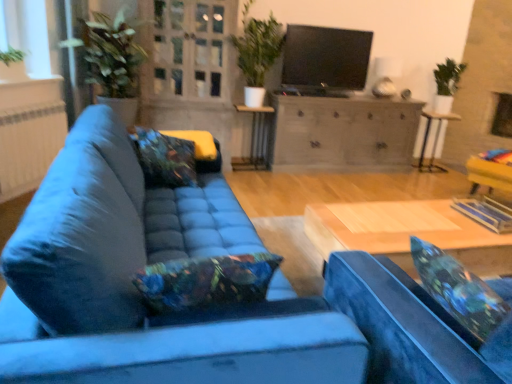
Question: Is the depth of white textured radiator at left less than that of floral fabric pillow at center, the 1th pillow from the front?

Choices:
 (A) yes
 (B) no

Answer: (B)

Question: Is white textured radiator at left beside floral fabric pillow at center, marked as the first pillow in a left-to-right arrangement?

Choices:
 (A) no
 (B) yes

Answer: (A)

Question: Does white textured radiator at left appear on the right side of floral fabric pillow at center, the 1th pillow from the front?

Choices:
 (A) yes
 (B) no

Answer: (B)

Question: Can you confirm if white textured radiator at left is wider than floral fabric pillow at center, the second pillow positioned from the back?

Choices:
 (A) yes
 (B) no

Answer: (B)

Question: Does white textured radiator at left come behind floral fabric pillow at center, the 1th pillow from the front?

Choices:
 (A) no
 (B) yes

Answer: (B)

Question: Is white textured radiator at left taller than floral fabric pillow at center, the second pillow viewed from the right?

Choices:
 (A) no
 (B) yes

Answer: (B)

Question: Does floral fabric pillow at lower right, placed as the first pillow when sorted from back to front, have a smaller size compared to white glossy stool at right?

Choices:
 (A) no
 (B) yes

Answer: (B)

Question: From a real-world perspective, is floral fabric pillow at lower right, positioned as the second pillow in front-to-back order, physically below white glossy stool at right?

Choices:
 (A) no
 (B) yes

Answer: (A)

Question: Does floral fabric pillow at lower right, placed as the first pillow when sorted from back to front, have a greater height compared to white glossy stool at right?

Choices:
 (A) yes
 (B) no

Answer: (B)

Question: Is floral fabric pillow at lower right, the second pillow from the left, looking in the opposite direction of white glossy stool at right?

Choices:
 (A) yes
 (B) no

Answer: (B)

Question: Is the depth of floral fabric pillow at lower right, placed as the first pillow when sorted from back to front, greater than that of white glossy stool at right?

Choices:
 (A) yes
 (B) no

Answer: (B)

Question: Is floral fabric pillow at lower right, the second pillow from the left, touching white glossy stool at right?

Choices:
 (A) no
 (B) yes

Answer: (A)

Question: Is metallic silver side table at center not inside white matte window screen at upper left?

Choices:
 (A) yes
 (B) no

Answer: (A)